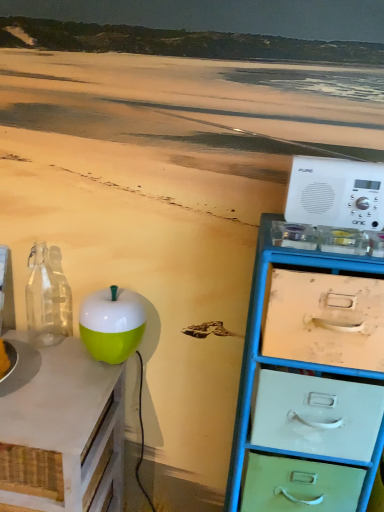
Question: Should I look upward or downward to see green glossy apple at center-left?

Choices:
 (A) down
 (B) up

Answer: (A)

Question: Considering the relative sizes of transparent glass bottle at left and green matte apple at left in the image provided, is transparent glass bottle at left shorter than green matte apple at left?

Choices:
 (A) no
 (B) yes

Answer: (B)

Question: Does transparent glass bottle at left have a lesser width compared to green matte apple at left?

Choices:
 (A) yes
 (B) no

Answer: (A)

Question: Can you confirm if transparent glass bottle at left is smaller than green matte apple at left?

Choices:
 (A) yes
 (B) no

Answer: (A)

Question: Is transparent glass bottle at left outside green matte apple at left?

Choices:
 (A) yes
 (B) no

Answer: (A)

Question: Does transparent glass bottle at left lie behind green matte apple at left?

Choices:
 (A) yes
 (B) no

Answer: (A)

Question: Does transparent glass bottle at left have a greater height compared to green matte apple at left?

Choices:
 (A) no
 (B) yes

Answer: (A)

Question: Could you tell me if green matte apple at left is turned towards metallic blue chest of drawers at right?

Choices:
 (A) yes
 (B) no

Answer: (B)

Question: Does green matte apple at left have a larger size compared to metallic blue chest of drawers at right?

Choices:
 (A) no
 (B) yes

Answer: (B)

Question: Is the depth of green matte apple at left greater than that of metallic blue chest of drawers at right?

Choices:
 (A) yes
 (B) no

Answer: (A)

Question: From a real-world perspective, is green matte apple at left located higher than metallic blue chest of drawers at right?

Choices:
 (A) no
 (B) yes

Answer: (A)

Question: Can you confirm if green matte apple at left is positioned to the left of metallic blue chest of drawers at right?

Choices:
 (A) no
 (B) yes

Answer: (B)

Question: Is metallic blue chest of drawers at right at the back of green matte apple at left?

Choices:
 (A) no
 (B) yes

Answer: (A)

Question: Is white plastic radio at right positioned before metallic blue chest of drawers at right?

Choices:
 (A) yes
 (B) no

Answer: (B)